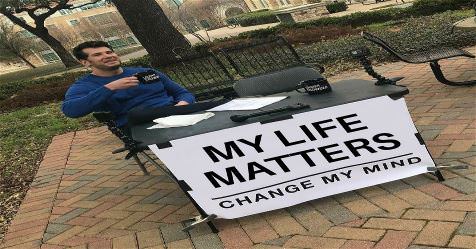
You are a GUI agent. You are given a task and a screenshot of the screen. Output one action in this format:
    pyautogui.click(x=<x>, y=<y>)
    Task: Click on the black coffee mug
    
    Given the screenshot: What is the action you would take?
    pyautogui.click(x=319, y=89), pyautogui.click(x=152, y=81)